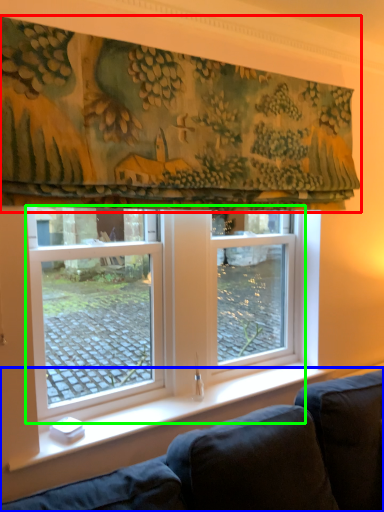
Question: Which object is the farthest from curtain (highlighted by a red box)? Choose among these: studio couch (highlighted by a blue box) or window (highlighted by a green box).

Choices:
 (A) studio couch
 (B) window

Answer: (A)